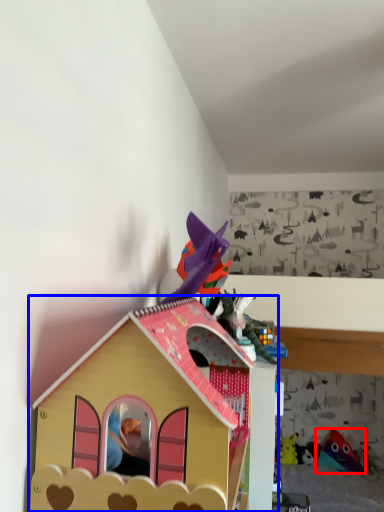
Question: Which object is further to the camera taking this photo, toy (highlighted by a red box) or toy (highlighted by a blue box)?

Choices:
 (A) toy
 (B) toy

Answer: (A)